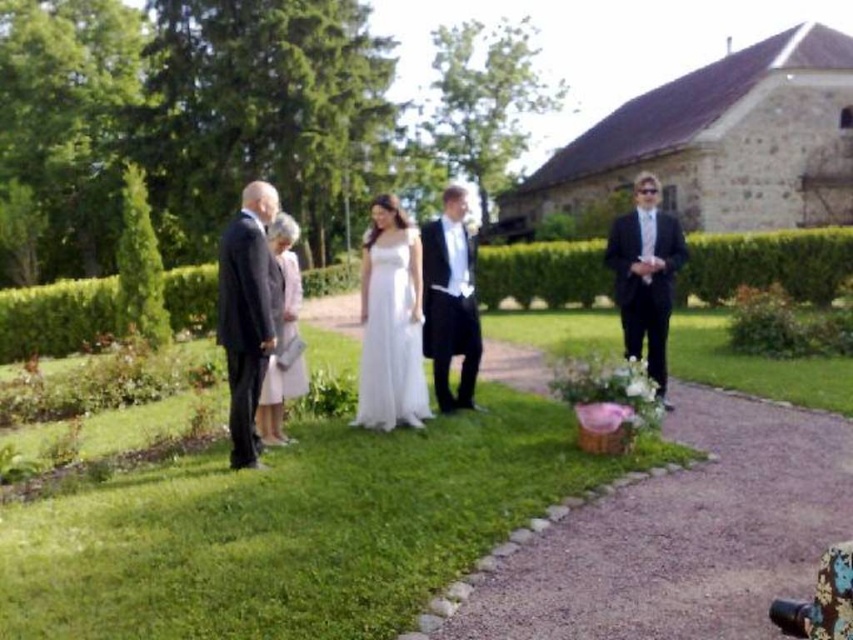
Question: Is white satin dress at center above light pink satin dress at center?

Choices:
 (A) yes
 (B) no

Answer: (B)

Question: Can you confirm if green grass at center is positioned to the right of shiny black suit at center?

Choices:
 (A) yes
 (B) no

Answer: (B)

Question: Which object appears closest to the camera in this image?

Choices:
 (A) dark gray suit at left
 (B) white satin dress at center
 (C) shiny black suit at center
 (D) matte black suit at right

Answer: (A)

Question: Estimate the real-world distances between objects in this image. Which object is farther from the green grass at center?

Choices:
 (A) shiny black suit at center
 (B) dark gray suit at left
 (C) white satin dress at center

Answer: (A)

Question: Estimate the real-world distances between objects in this image. Which object is farther from the shiny black suit at center?

Choices:
 (A) matte black suit at right
 (B) green grass at center
 (C) light pink satin dress at center
 (D) white satin dress at center

Answer: (A)

Question: Does matte black suit at right have a greater width compared to light pink satin dress at center?

Choices:
 (A) yes
 (B) no

Answer: (A)